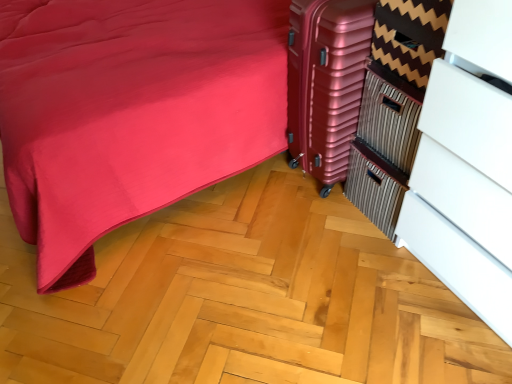
Question: Is metallic pink suitcase at center-right to the left or to the right of white glossy dresser at right in the image?

Choices:
 (A) left
 (B) right

Answer: (A)

Question: In terms of height, does metallic pink suitcase at center-right look taller or shorter compared to white glossy dresser at right?

Choices:
 (A) short
 (B) tall

Answer: (A)

Question: From a real-world perspective, relative to white glossy dresser at right, is metallic pink suitcase at center-right vertically above or below?

Choices:
 (A) above
 (B) below

Answer: (B)

Question: Considering the positions of point (449, 132) and point (318, 34), is point (449, 132) closer or farther from the camera than point (318, 34)?

Choices:
 (A) closer
 (B) farther

Answer: (A)

Question: From a real-world perspective, is white glossy dresser at right positioned above or below metallic pink suitcase at center-right?

Choices:
 (A) below
 (B) above

Answer: (B)

Question: From the image's perspective, is white glossy dresser at right located above or below metallic pink suitcase at center-right?

Choices:
 (A) above
 (B) below

Answer: (B)

Question: Looking at their shapes, would you say white glossy dresser at right is wider or thinner than metallic pink suitcase at center-right?

Choices:
 (A) wide
 (B) thin

Answer: (B)